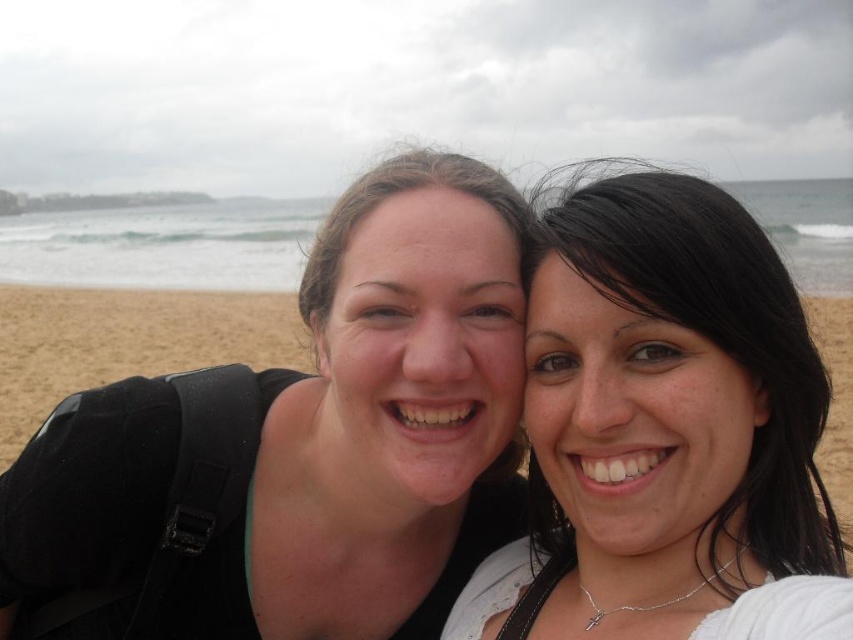
Question: Can you confirm if matte black backpack at left is positioned above smooth white blouse at center?

Choices:
 (A) no
 (B) yes

Answer: (A)

Question: Is matte black backpack at left thinner than smooth white blouse at center?

Choices:
 (A) yes
 (B) no

Answer: (B)

Question: Which of the following is the farthest from the observer?

Choices:
 (A) (381, 564)
 (B) (677, 508)

Answer: (A)

Question: Which point is closer to the camera taking this photo?

Choices:
 (A) (657, 220)
 (B) (357, 289)

Answer: (A)

Question: Can you confirm if matte black backpack at left is positioned above smooth white blouse at center?

Choices:
 (A) yes
 (B) no

Answer: (B)